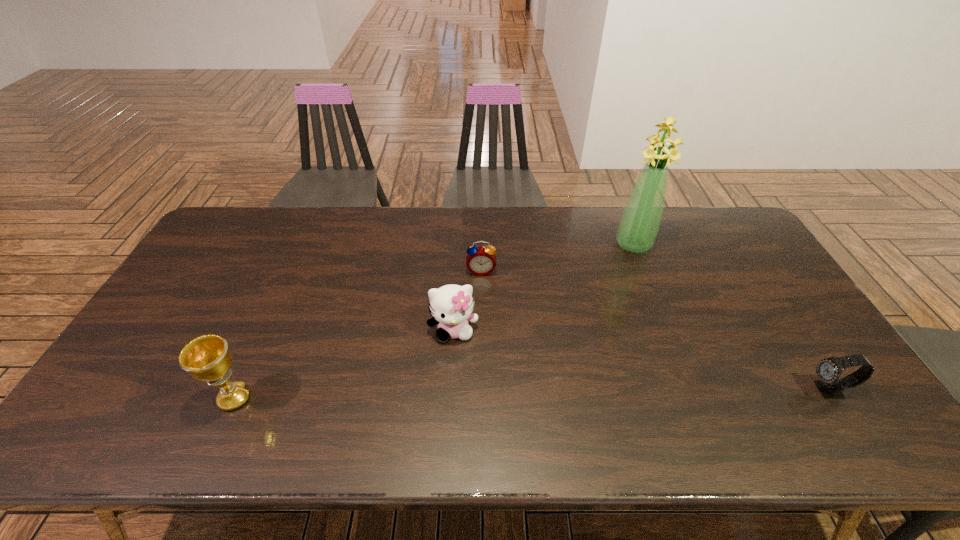
Where is `vacant space at the far right corner`? The width and height of the screenshot is (960, 540). vacant space at the far right corner is located at coordinates (707, 241).

Find the location of a particular element. vacant region between the second object from right to left and the second farthest object is located at coordinates point(557,258).

What are the coordinates of `blank region between the alarm clock and the watch` in the screenshot? It's located at (655, 330).

The height and width of the screenshot is (540, 960). Find the location of `empty space between the second farthest object and the watch`. empty space between the second farthest object and the watch is located at coordinates (655, 330).

This screenshot has height=540, width=960. What are the coordinates of `free space that is in between the kitten and the watch` in the screenshot? It's located at coord(641,360).

In order to click on empty space that is in between the rightmost object and the leftmost object in this screenshot , I will do `click(532, 394)`.

Locate an element on the screen. free space that is in between the fourth nearest object and the watch is located at coordinates (655, 330).

Where is `vacant area that lies between the tallest object and the second farthest object`? vacant area that lies between the tallest object and the second farthest object is located at coordinates (557, 258).

Where is `vacant space that's between the watch and the chalice`? This screenshot has height=540, width=960. vacant space that's between the watch and the chalice is located at coordinates (532, 394).

Identify the location of free spot between the third farthest object and the leftmost object. (344, 364).